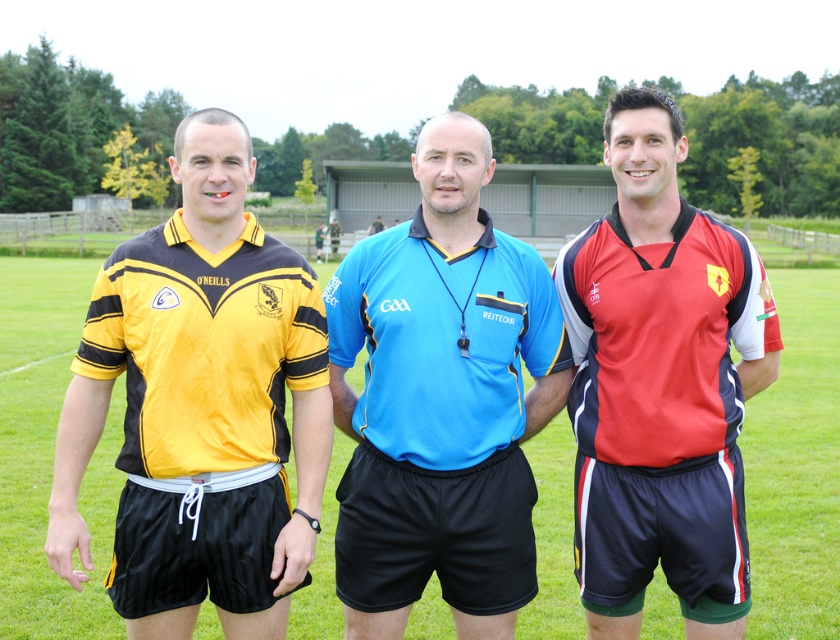
Does yellow matte jersey at left have a lesser height compared to red matte jersey at right?

Yes.

Is yellow matte jersey at left thinner than red matte jersey at right?

Incorrect, yellow matte jersey at left's width is not less than red matte jersey at right's.

Which is in front, point (75, 572) or point (655, 109)?

Point (75, 572) is more forward.

The width and height of the screenshot is (840, 640). I want to click on yellow matte jersey at left, so click(200, 406).

Describe the element at coordinates (441, 401) in the screenshot. I see `blue jersey at center` at that location.

What do you see at coordinates (441, 401) in the screenshot?
I see `blue jersey at center` at bounding box center [441, 401].

Locate an element on the screen. This screenshot has height=640, width=840. blue jersey at center is located at coordinates (441, 401).

Who is positioned more to the right, blue jersey at center or red matte jersey at right?

red matte jersey at right is more to the right.

Between blue jersey at center and red matte jersey at right, which one is positioned lower?

blue jersey at center is lower down.

At what (x,y) coordinates should I click in order to perform the action: click on blue jersey at center. Please return your answer as a coordinate pair (x, y). This screenshot has height=640, width=840. Looking at the image, I should click on [x=441, y=401].